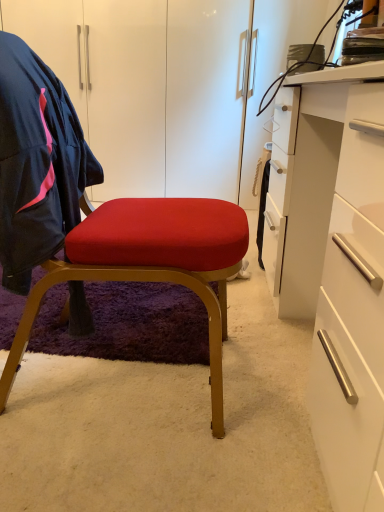
Question: From the image's perspective, is velvet red cushion at center positioned above or below white glossy desk at right?

Choices:
 (A) above
 (B) below

Answer: (A)

Question: Considering the positions of velvet red cushion at center and white glossy desk at right in the image, is velvet red cushion at center wider or thinner than white glossy desk at right?

Choices:
 (A) thin
 (B) wide

Answer: (B)

Question: Which object is the farthest from the velvet red cushion at center?

Choices:
 (A) navy blue fabric jacket at left
 (B) white glossy desk at right

Answer: (B)

Question: Which object is positioned closest to the velvet red cushion at center?

Choices:
 (A) navy blue fabric jacket at left
 (B) white glossy desk at right

Answer: (A)